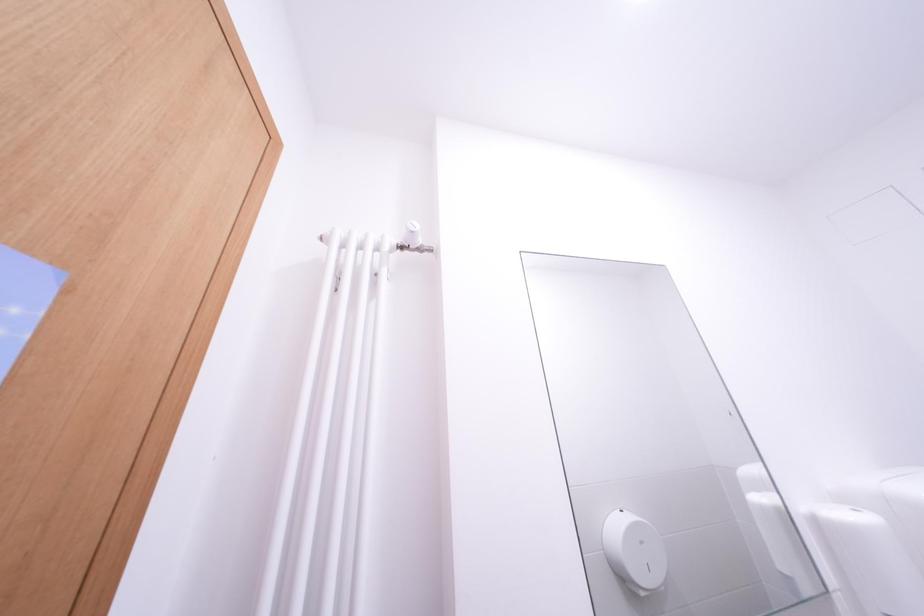
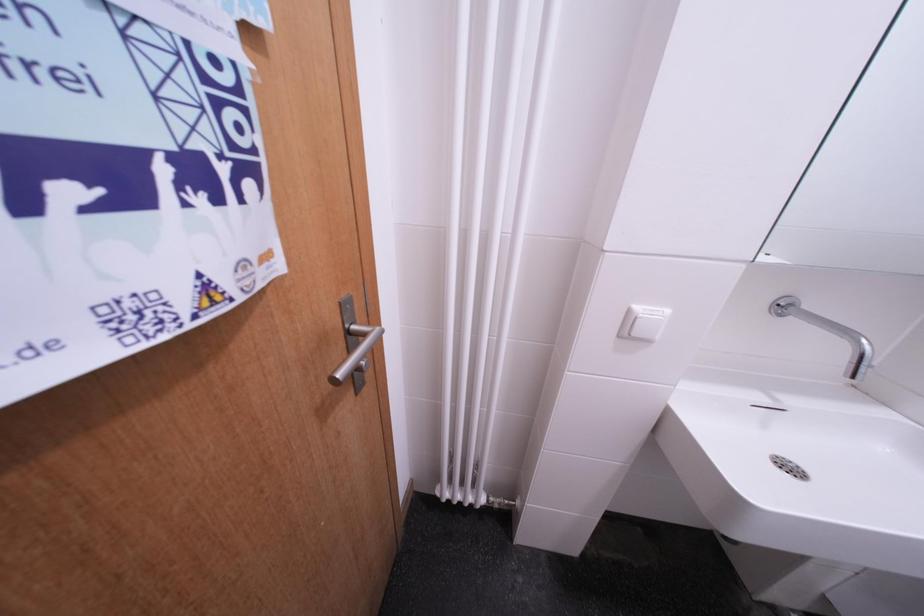
The images are taken continuously from a first-person perspective. In which direction is your viewpoint rotating?

The rotation direction of the camera is left-down.